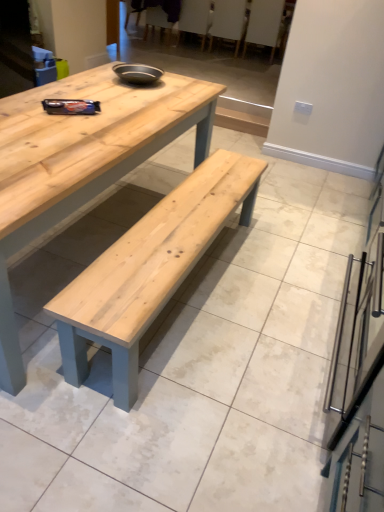
Measure the distance between natural wood bench at center and camera.

1.42 meters.

The height and width of the screenshot is (512, 384). Describe the element at coordinates (149, 269) in the screenshot. I see `natural wood bench at center` at that location.

Where is `natural wood bench at center`? natural wood bench at center is located at coordinates (149, 269).

Find the location of `natural wood bench at center`. natural wood bench at center is located at coordinates (149, 269).